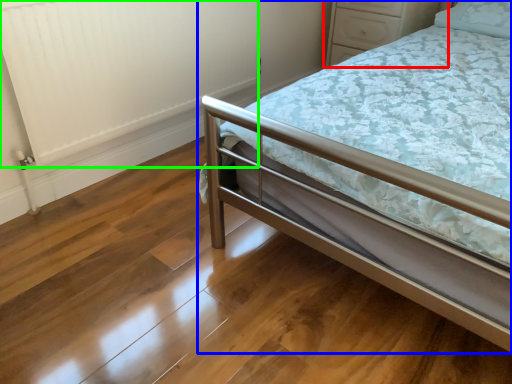
Question: Which object is the farthest from dresser (highlighted by a red box)? Choose among these: bed (highlighted by a blue box) or radiator (highlighted by a green box).

Choices:
 (A) bed
 (B) radiator

Answer: (A)